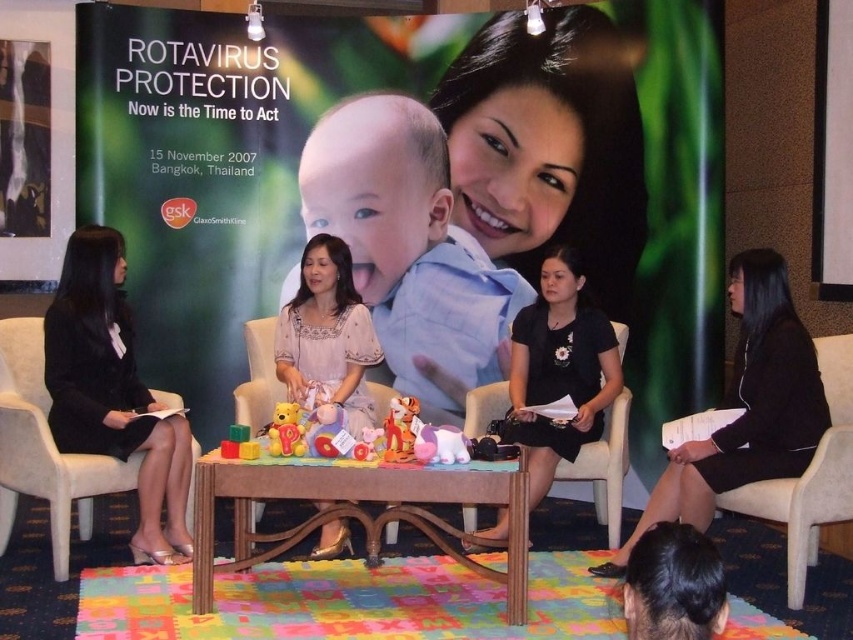
Between black fabric dress at right and soft plush unicorn at center, which one is positioned higher?

soft plush unicorn at center is above.

Which is behind, point (811, 435) or point (440, 432)?

The point (811, 435) is more distant.

Identify the location of black fabric dress at right. This screenshot has width=853, height=640. (746, 406).

Is point (74, 336) positioned after point (257, 456)?

Yes, it is.

Does black fabric dress at left appear over matte plastic blocks at center?

Yes.

This screenshot has height=640, width=853. In order to click on black fabric dress at left in this screenshot , I will do `click(113, 392)`.

Between smooth skin baby at center and black fabric dress at left, which one is positioned higher?

smooth skin baby at center is above.

Between point (405, 253) and point (166, 440), which one is positioned behind?

Positioned behind is point (405, 253).

Between point (344, 125) and point (79, 429), which one is positioned behind?

Point (344, 125)

The height and width of the screenshot is (640, 853). In order to click on smooth skin baby at center in this screenshot , I will do `click(410, 248)`.